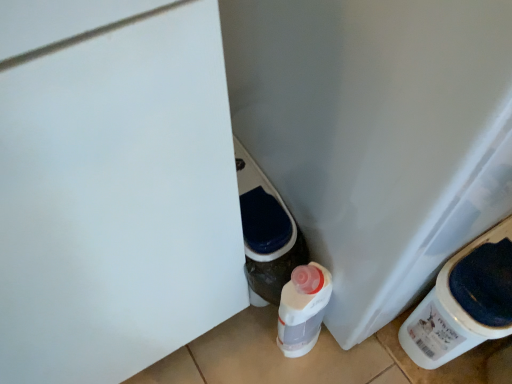
Question: From the image's perspective, does white plastic water cooler at lower right appear higher than white matte door at center?

Choices:
 (A) yes
 (B) no

Answer: (A)

Question: Can you confirm if white plastic water cooler at lower right is thinner than white matte door at center?

Choices:
 (A) no
 (B) yes

Answer: (A)

Question: Would you say white matte door at center is part of white plastic water cooler at lower right's contents?

Choices:
 (A) yes
 (B) no

Answer: (B)

Question: Is white plastic water cooler at lower right wider than white matte door at center?

Choices:
 (A) no
 (B) yes

Answer: (B)

Question: Does white plastic water cooler at lower right have a greater height compared to white matte door at center?

Choices:
 (A) yes
 (B) no

Answer: (B)

Question: Can you confirm if white plastic water cooler at lower right is positioned to the left of white matte door at center?

Choices:
 (A) no
 (B) yes

Answer: (A)

Question: From the image's perspective, would you say white matte door at center is shown under white plastic water cooler at lower right?

Choices:
 (A) yes
 (B) no

Answer: (A)

Question: Does white matte door at center have a lesser height compared to white plastic water cooler at lower right?

Choices:
 (A) no
 (B) yes

Answer: (A)

Question: Is white matte door at center oriented away from white plastic water cooler at lower right?

Choices:
 (A) yes
 (B) no

Answer: (B)

Question: Considering the relative sizes of white matte door at center and white plastic water cooler at lower right in the image provided, is white matte door at center wider than white plastic water cooler at lower right?

Choices:
 (A) no
 (B) yes

Answer: (A)

Question: Can you see white matte door at center touching white plastic water cooler at lower right?

Choices:
 (A) no
 (B) yes

Answer: (A)

Question: Can you confirm if white matte door at center is smaller than white plastic water cooler at lower right?

Choices:
 (A) no
 (B) yes

Answer: (B)

Question: From their relative heights in the image, would you say white plastic water cooler at lower right is taller or shorter than white matte door at center?

Choices:
 (A) tall
 (B) short

Answer: (B)